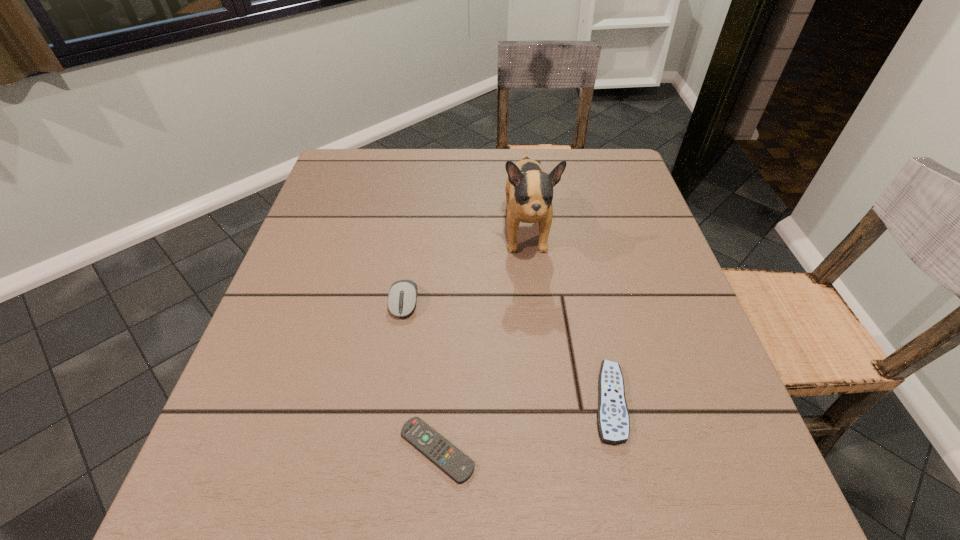
Where is `free location located 0.060m on the right of the second shortest object`? This screenshot has width=960, height=540. free location located 0.060m on the right of the second shortest object is located at coordinates (663, 402).

Where is `free region located 0.280m on the right of the shortest object`? This screenshot has height=540, width=960. free region located 0.280m on the right of the shortest object is located at coordinates (658, 450).

What are the coordinates of `object present at the near edge` in the screenshot? It's located at (457, 465).

In the image, there is a desktop. Where is `vacant space at the far edge`? Image resolution: width=960 pixels, height=540 pixels. vacant space at the far edge is located at coordinates (492, 180).

This screenshot has height=540, width=960. I want to click on blank area at the near edge, so (x=564, y=478).

You are a GUI agent. You are given a task and a screenshot of the screen. Output one action in this format:
    pyautogui.click(x=<x>, y=<y>)
    Task: Click on the free region at the left edge of the desktop
    The image size is (960, 540).
    Given the screenshot: What is the action you would take?
    pyautogui.click(x=307, y=389)

I want to click on vacant space at the right edge of the desktop, so click(671, 319).

In the image, there is a desktop. Find the location of `vacant space at the far left corner`. vacant space at the far left corner is located at coordinates point(387,150).

The width and height of the screenshot is (960, 540). In order to click on blank space at the far right corner in this screenshot , I will do `click(585, 171)`.

Locate an element on the screen. The width and height of the screenshot is (960, 540). unoccupied position between the third tallest object and the puppy is located at coordinates (567, 317).